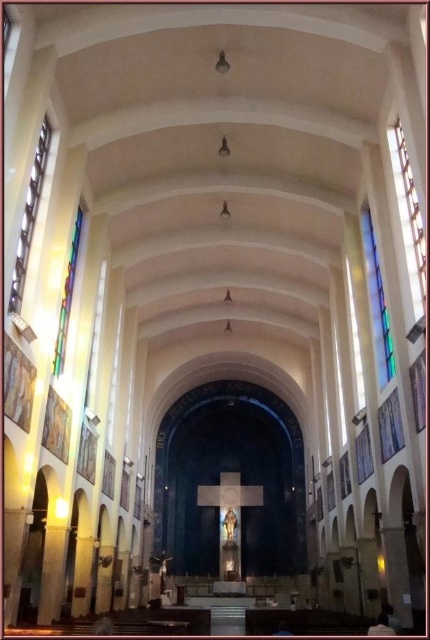
Question: Does stained glass window at right appear over multicolored stained glass at left?

Choices:
 (A) no
 (B) yes

Answer: (B)

Question: Is stained glass window at right positioned at the back of clear glass window at left?

Choices:
 (A) no
 (B) yes

Answer: (B)

Question: Does clear glass window at left lie in front of multicolored stained glass at left?

Choices:
 (A) no
 (B) yes

Answer: (B)

Question: Which point is farther to the camera?

Choices:
 (A) clear glass window at left
 (B) translucent stained glass at upper right
 (C) stained glass window at right

Answer: (B)

Question: Based on their relative distances, which object is nearer to the clear glass window at left?

Choices:
 (A) translucent stained glass at upper right
 (B) multicolored stained glass at left

Answer: (B)

Question: Based on their relative distances, which object is nearer to the translucent stained glass at upper right?

Choices:
 (A) clear glass window at left
 (B) multicolored stained glass at left
 (C) stained glass window at right

Answer: (C)